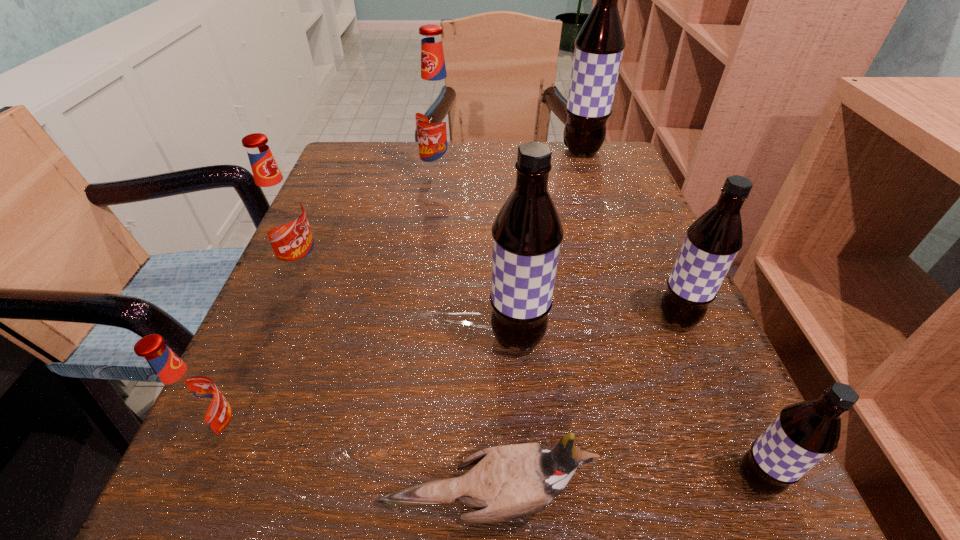
Image resolution: width=960 pixels, height=540 pixels. What are the coordinates of `the third nearest object` in the screenshot? It's located at (190, 397).

The width and height of the screenshot is (960, 540). I want to click on the nearest brown root beer, so click(x=804, y=433).

Locate an element on the screen. This screenshot has height=540, width=960. the nearest root beer is located at coordinates (804, 433).

Identify the location of the shortest object. The image size is (960, 540). (508, 482).

What are the coordinates of `vacant area situated 0.270m on the left of the tallest root beer` in the screenshot? It's located at (445, 151).

Where is `vacant space located 0.370m on the right of the seventh nearest object`? The image size is (960, 540). vacant space located 0.370m on the right of the seventh nearest object is located at coordinates (632, 179).

Where is `vacant space positioned on the left of the leftmost brown root beer`? vacant space positioned on the left of the leftmost brown root beer is located at coordinates (324, 338).

Locate an element on the screen. Image resolution: width=960 pixels, height=540 pixels. vacant region located 0.290m on the right of the second smallest red root beer is located at coordinates (492, 269).

This screenshot has width=960, height=540. What are the coordinates of `vacant space located on the left of the third biggest brown root beer` in the screenshot? It's located at (511, 318).

Image resolution: width=960 pixels, height=540 pixels. What are the coordinates of `free space located 0.350m on the back of the second nearest root beer` in the screenshot? It's located at (x=308, y=240).